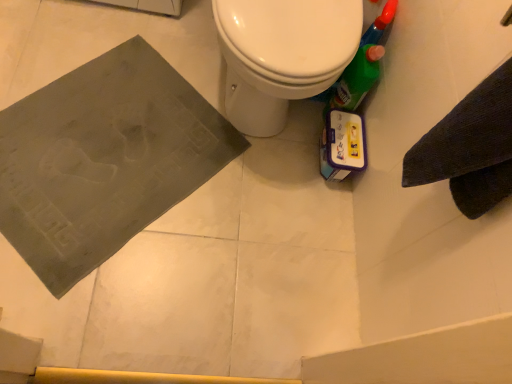
Find the location of a particular element. dark gray rubber mat at lower left is located at coordinates (104, 159).

The image size is (512, 384). What do you see at coordinates (104, 159) in the screenshot?
I see `dark gray rubber mat at lower left` at bounding box center [104, 159].

Where is `dark gray rubber mat at lower left`? This screenshot has height=384, width=512. dark gray rubber mat at lower left is located at coordinates (104, 159).